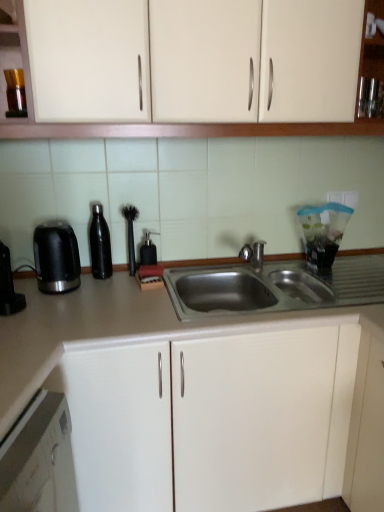
Where is `vacant region to the right of black matte water bottle at left, which is counted as the first appliance, starting from the left`? The image size is (384, 512). vacant region to the right of black matte water bottle at left, which is counted as the first appliance, starting from the left is located at coordinates (145, 291).